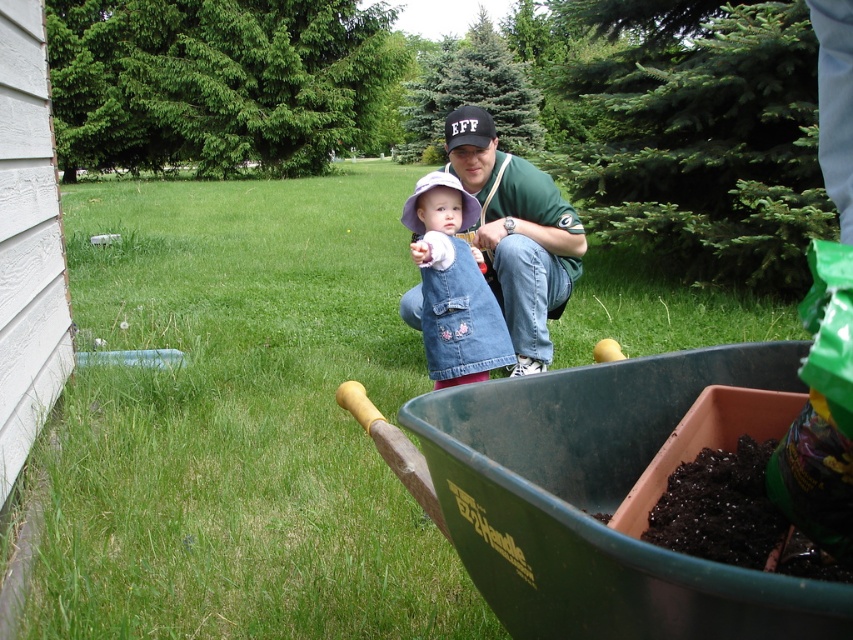
Which is more to the right, green grass at lower left or denim vest at center?

Positioned to the right is denim vest at center.

In the scene shown: Is green grass at lower left taller than denim vest at center?

Yes, green grass at lower left is taller than denim vest at center.

Between point (335, 273) and point (421, 188), which one is positioned in front?

Positioned in front is point (421, 188).

Identify the location of green grass at lower left. (241, 420).

Does green grass at lower left appear on the right side of green jersey at center?

No, green grass at lower left is not to the right of green jersey at center.

Does point (329, 189) come behind point (480, 246)?

Yes, point (329, 189) is behind point (480, 246).

Where is `green grass at lower left`? The width and height of the screenshot is (853, 640). green grass at lower left is located at coordinates (241, 420).

Who is more forward, [561,241] or [474,204]?

Positioned in front is point [474,204].

Which is below, green jersey at center or denim vest at center?

Positioned lower is denim vest at center.

Is point (450, 113) positioned behind point (421, 200)?

Yes, it is.

Locate an element on the screen. green jersey at center is located at coordinates (515, 234).